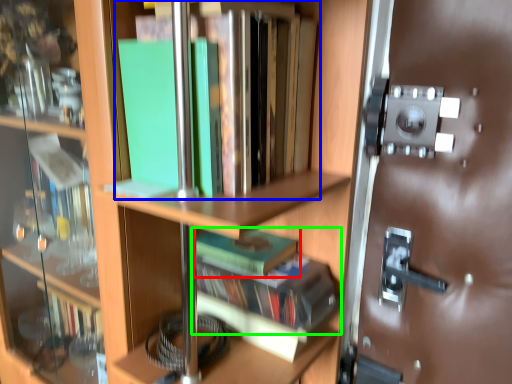
Question: Based on their relative distances, which object is nearer to book (highlighted by a red box)? Choose from book (highlighted by a blue box) and book (highlighted by a green box).

Choices:
 (A) book
 (B) book

Answer: (B)